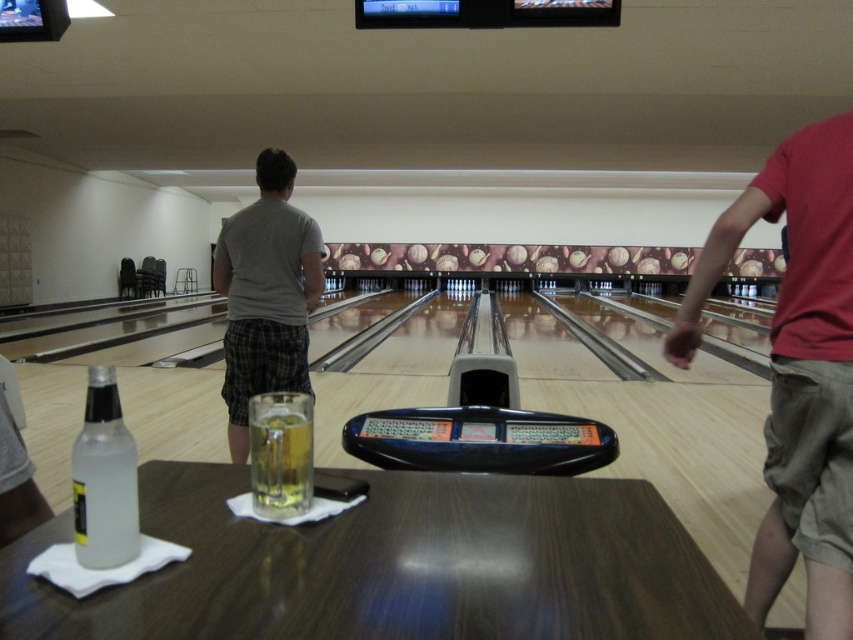
From the picture: Is red cotton shirt at right positioned before clear glass bottle at table left?

No.

The image size is (853, 640). Describe the element at coordinates (798, 371) in the screenshot. I see `red cotton shirt at right` at that location.

This screenshot has width=853, height=640. I want to click on red cotton shirt at right, so click(798, 371).

Which of these two, wooden table at center or clear glass bottle at table left, stands shorter?

With less height is wooden table at center.

Measure the distance from wooden table at center to clear glass bottle at table left.

A distance of 40.48 centimeters exists between wooden table at center and clear glass bottle at table left.

Where is `wooden table at center`? The image size is (853, 640). wooden table at center is located at coordinates (393, 564).

Describe the element at coordinates (265, 294) in the screenshot. The image size is (853, 640). I see `gray cotton t-shirt at center` at that location.

This screenshot has height=640, width=853. What are the coordinates of `gray cotton t-shirt at center` in the screenshot? It's located at (265, 294).